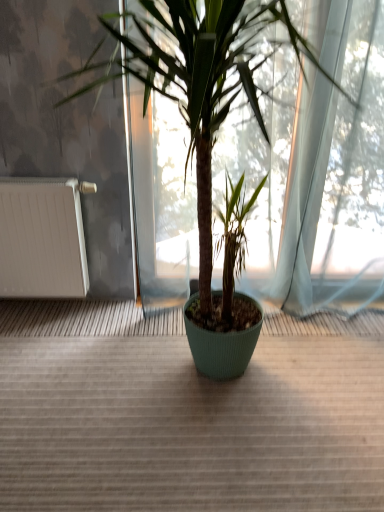
Question: Would you say green ribbed pot at center is to the left or to the right of white matte radiator at left in the picture?

Choices:
 (A) left
 (B) right

Answer: (B)

Question: In terms of width, does green ribbed pot at center look wider or thinner when compared to white matte radiator at left?

Choices:
 (A) thin
 (B) wide

Answer: (B)

Question: From the image's perspective, relative to white matte radiator at left, is green ribbed pot at center above or below?

Choices:
 (A) below
 (B) above

Answer: (B)

Question: Looking at the image, does white matte radiator at left seem bigger or smaller compared to green ribbed pot at center?

Choices:
 (A) big
 (B) small

Answer: (B)

Question: In terms of width, does white matte radiator at left look wider or thinner when compared to green ribbed pot at center?

Choices:
 (A) wide
 (B) thin

Answer: (B)

Question: Is point (38, 266) closer or farther from the camera than point (107, 16)?

Choices:
 (A) farther
 (B) closer

Answer: (A)

Question: In the image, is white matte radiator at left positioned in front of or behind green ribbed pot at center?

Choices:
 (A) front
 (B) behind

Answer: (B)